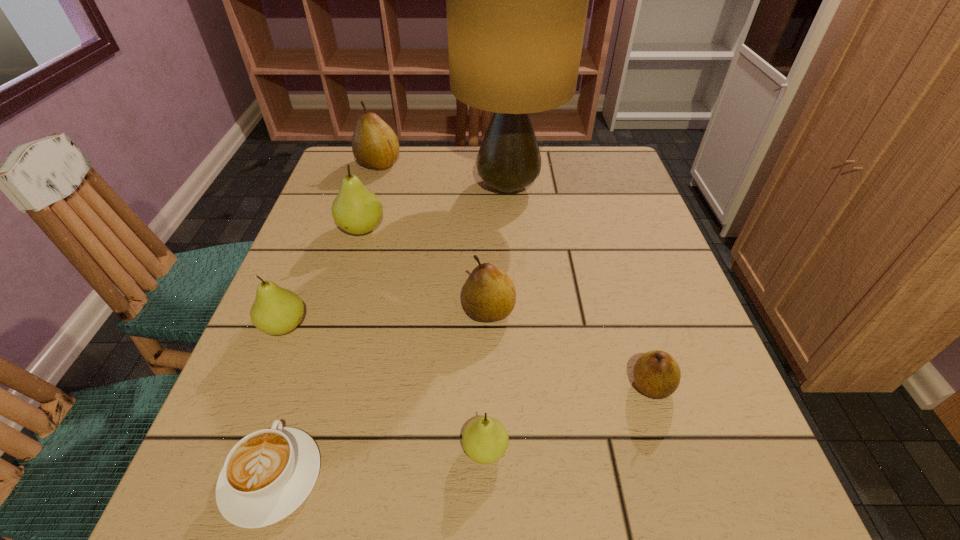
What are the coordinates of `the nearest green pear` in the screenshot? It's located at (485, 440).

Locate an element on the screen. the smallest brown pear is located at coordinates (656, 373).

Image resolution: width=960 pixels, height=540 pixels. Identify the location of the nearest brown pear. (656, 373).

Where is `white cappuccino`? This screenshot has width=960, height=540. white cappuccino is located at coordinates (268, 474).

You are a GUI agent. You are given a task and a screenshot of the screen. Output one action in this format:
    pyautogui.click(x=<x>, y=<y>)
    Task: Click on the shortest object
    Image resolution: width=960 pixels, height=540 pixels.
    Given the screenshot: What is the action you would take?
    pyautogui.click(x=268, y=474)

The image size is (960, 540). What are the coordinates of `vacant space located on the front of the beige lampshade` in the screenshot? It's located at (516, 304).

Identify the location of vacant region located on the front of the farthest brown pear. The height and width of the screenshot is (540, 960). (347, 268).

Find the location of a particular element. vacant space located on the front of the biggest green pear is located at coordinates (350, 266).

The image size is (960, 540). I want to click on free space located 0.140m on the back of the second nearest green pear, so click(x=311, y=259).

At what (x,y) coordinates should I click in order to perform the action: click on vacant space located on the back of the second nearest brown pear. Please return your answer as a coordinate pair (x, y). This screenshot has height=540, width=960. Looking at the image, I should click on (488, 255).